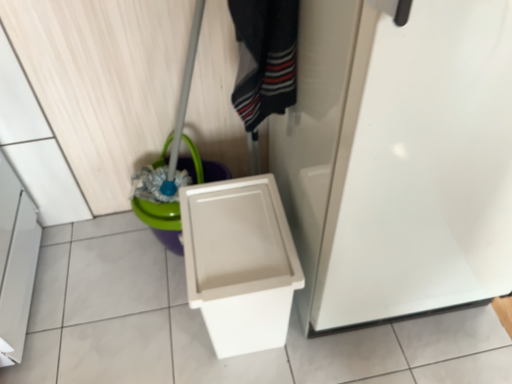
Question: Considering the relative sizes of white plastic toilet at lower right and white glossy screen door at center in the image provided, is white plastic toilet at lower right thinner than white glossy screen door at center?

Choices:
 (A) yes
 (B) no

Answer: (A)

Question: Does white plastic toilet at lower right appear on the right side of white glossy screen door at center?

Choices:
 (A) yes
 (B) no

Answer: (B)

Question: Could you tell me if white plastic toilet at lower right is turned towards white glossy screen door at center?

Choices:
 (A) yes
 (B) no

Answer: (B)

Question: From the image's perspective, does white plastic toilet at lower right appear higher than white glossy screen door at center?

Choices:
 (A) no
 (B) yes

Answer: (A)

Question: Can you confirm if white plastic toilet at lower right is wider than white glossy screen door at center?

Choices:
 (A) no
 (B) yes

Answer: (A)

Question: In the image, is white glossy screen door at center positioned in front of or behind green plastic bucket at lower left?

Choices:
 (A) behind
 (B) front

Answer: (B)

Question: Looking at the image, does white glossy screen door at center seem bigger or smaller compared to green plastic bucket at lower left?

Choices:
 (A) small
 (B) big

Answer: (B)

Question: Considering the relative positions of white glossy screen door at center and green plastic bucket at lower left in the image provided, is white glossy screen door at center to the left or to the right of green plastic bucket at lower left?

Choices:
 (A) left
 (B) right

Answer: (B)

Question: From the image's perspective, is white glossy screen door at center positioned above or below green plastic bucket at lower left?

Choices:
 (A) above
 (B) below

Answer: (A)

Question: From the image's perspective, is white plastic toilet at lower right above or below striped cotton socks at center?

Choices:
 (A) above
 (B) below

Answer: (B)

Question: Would you say white plastic toilet at lower right is to the left or to the right of striped cotton socks at center in the picture?

Choices:
 (A) left
 (B) right

Answer: (A)

Question: From a real-world perspective, is white plastic toilet at lower right positioned above or below striped cotton socks at center?

Choices:
 (A) below
 (B) above

Answer: (A)

Question: Relative to striped cotton socks at center, is white plastic toilet at lower right in front or behind?

Choices:
 (A) front
 (B) behind

Answer: (B)

Question: Would you say striped cotton socks at center is inside or outside white plastic toilet at lower right?

Choices:
 (A) outside
 (B) inside

Answer: (A)

Question: From the image's perspective, is striped cotton socks at center positioned above or below white plastic toilet at lower right?

Choices:
 (A) below
 (B) above

Answer: (B)